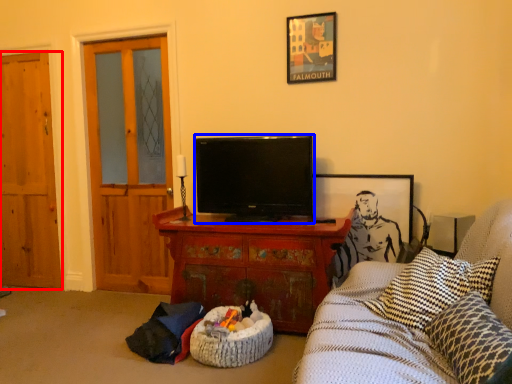
Question: Which of the following is the closest to the observer, door (highlighted by a red box) or television (highlighted by a blue box)?

Choices:
 (A) door
 (B) television

Answer: (B)